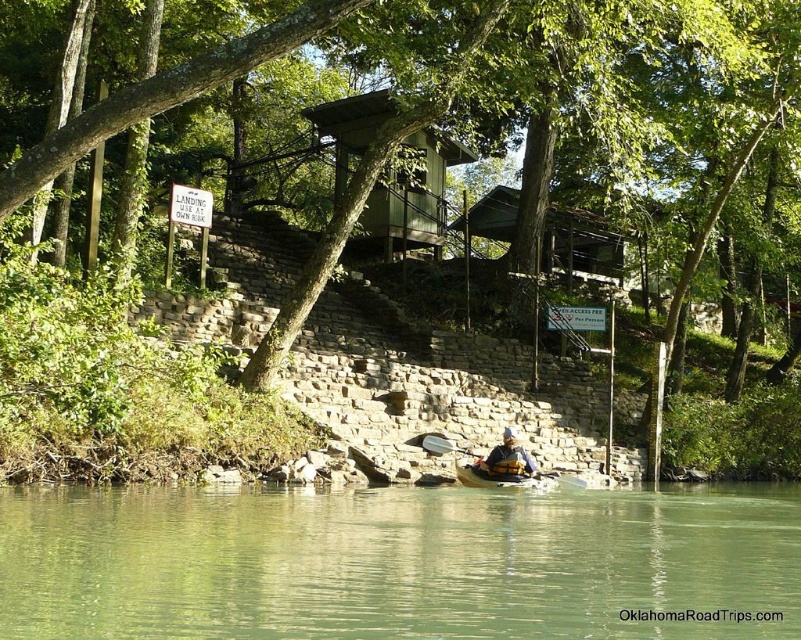
Does point (558, 474) come closer to viewer compared to point (506, 440)?

No, it is behind (506, 440).

Can you confirm if wooden paddle at center is shorter than yellow life vest at center?

In fact, wooden paddle at center may be taller than yellow life vest at center.

The width and height of the screenshot is (801, 640). Describe the element at coordinates (496, 467) in the screenshot. I see `wooden paddle at center` at that location.

The height and width of the screenshot is (640, 801). Identify the location of wooden paddle at center. (496, 467).

Who is taller, green translucent water at lower center or yellow plastic canoe at center?

Standing taller between the two is green translucent water at lower center.

I want to click on green translucent water at lower center, so click(x=400, y=563).

Which of these two, green translucent water at lower center or wooden paddle at center, stands shorter?

With less height is green translucent water at lower center.

What do you see at coordinates (400, 563) in the screenshot? The height and width of the screenshot is (640, 801). I see `green translucent water at lower center` at bounding box center [400, 563].

At what (x,y) coordinates should I click in order to perform the action: click on green translucent water at lower center. Please return your answer as a coordinate pair (x, y). This screenshot has height=640, width=801. Looking at the image, I should click on pos(400,563).

The width and height of the screenshot is (801, 640). What are the coordinates of `green translucent water at lower center` in the screenshot? It's located at (400, 563).